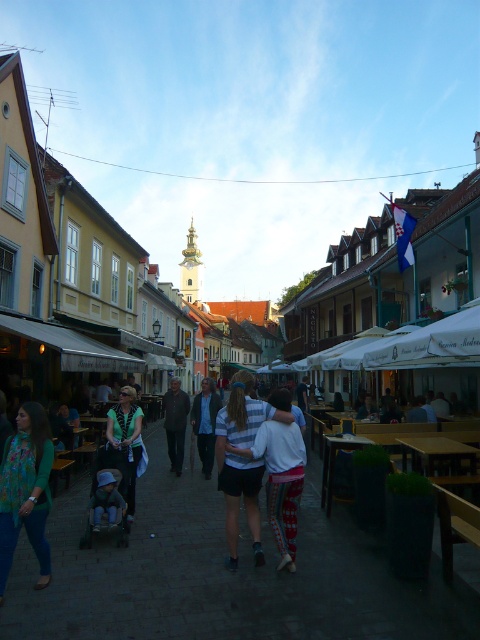
Question: Which object appears closest to the camera in this image?

Choices:
 (A) blue denim jacket at center
 (B) green textured sweater at lower left
 (C) green fabric shirt at center

Answer: (B)

Question: Is striped fabric shirt at center positioned behind blue denim jacket at center?

Choices:
 (A) no
 (B) yes

Answer: (A)

Question: Can you confirm if green textured sweater at lower left is thinner than blue denim jacket at center?

Choices:
 (A) no
 (B) yes

Answer: (B)

Question: Does matte black stroller at center have a larger size compared to green fabric shirt at center?

Choices:
 (A) no
 (B) yes

Answer: (B)

Question: Considering the real-world distances, which object is farthest from the matte black stroller at center?

Choices:
 (A) dark brown leather jacket at center
 (B) green fabric shirt at center
 (C) striped fabric shirt at center
 (D) green textured sweater at lower left

Answer: (A)

Question: Which of the following is the farthest from the observer?

Choices:
 (A) (296, 502)
 (B) (167, 422)
 (C) (2, 529)
 (D) (132, 444)

Answer: (B)